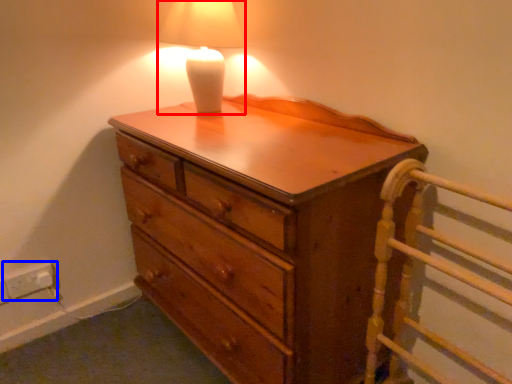
Question: Among these objects, which one is farthest to the camera, lamp (highlighted by a red box) or electric outlet (highlighted by a blue box)?

Choices:
 (A) lamp
 (B) electric outlet

Answer: (B)